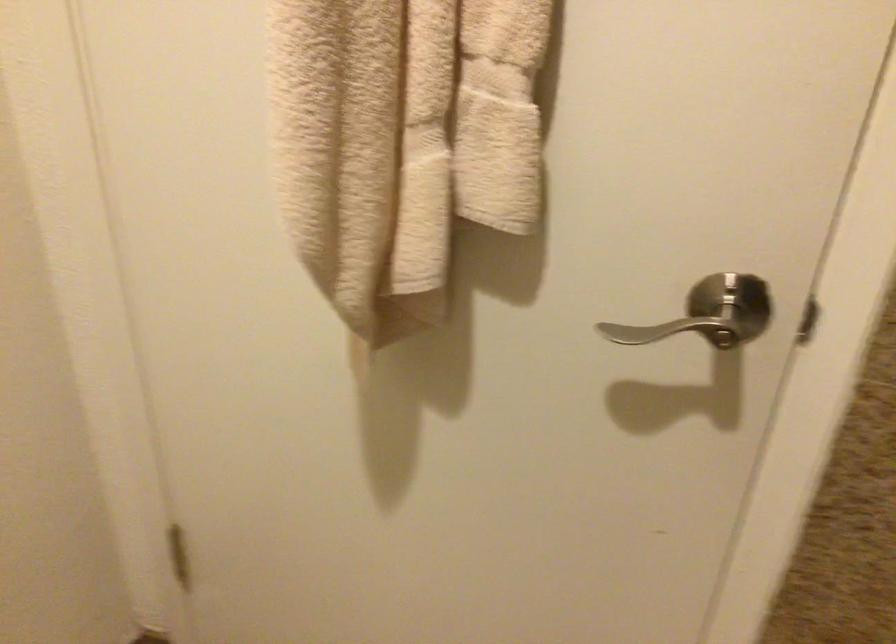
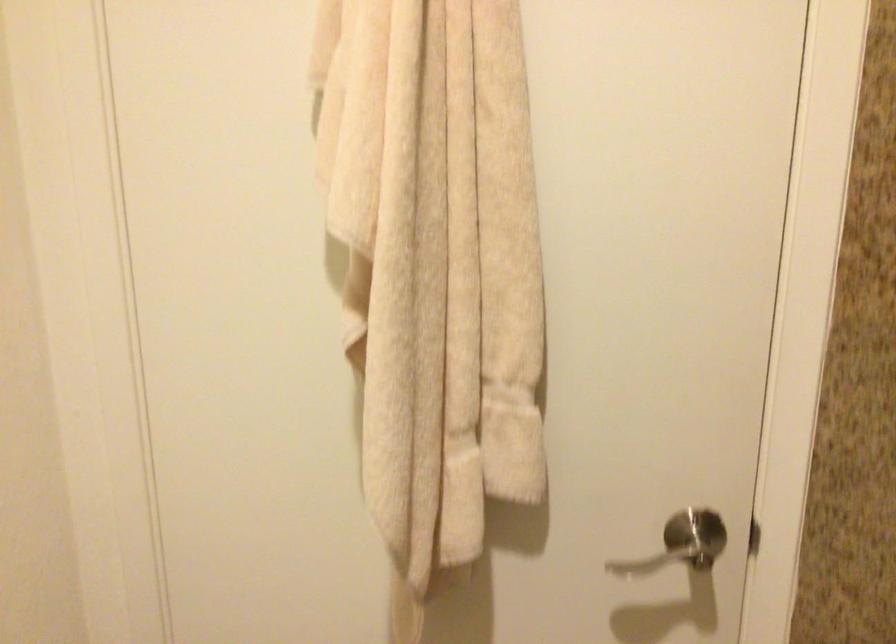
The images are taken continuously from a first-person perspective. In which direction are you moving?

The cameraman walked toward left, backward.